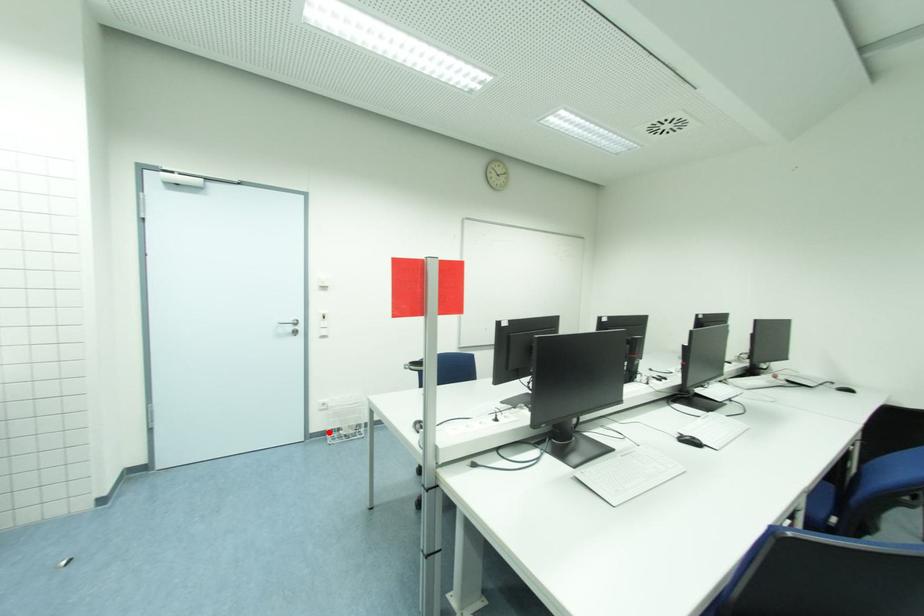
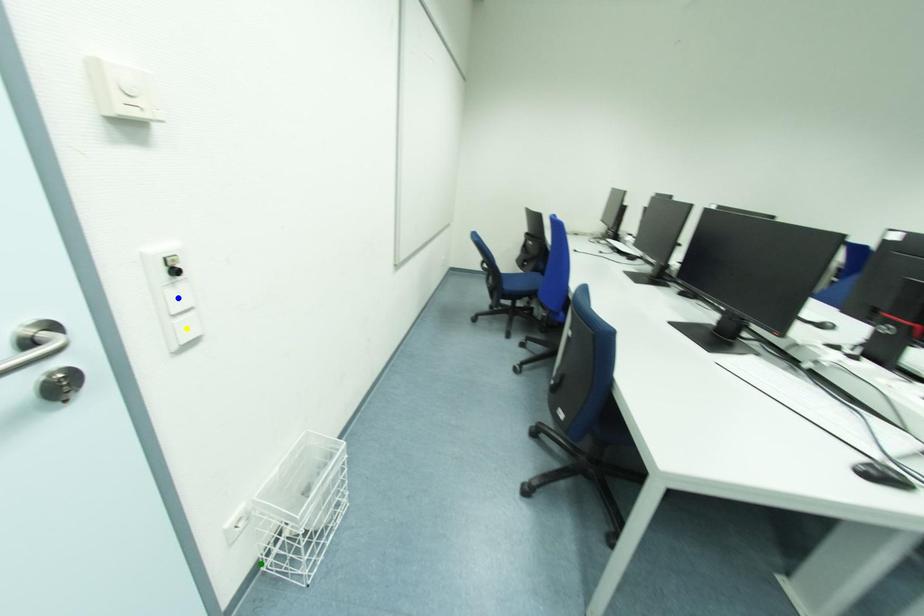
Question: I am providing you with two images of the same scene from different viewpoints. A red point is marked on the first image. You are given multiple points on the second image. Which spot in image 2 lines up with the point in image 1?

Choices:
 (A) green point
 (B) yellow point
 (C) blue point

Answer: (A)